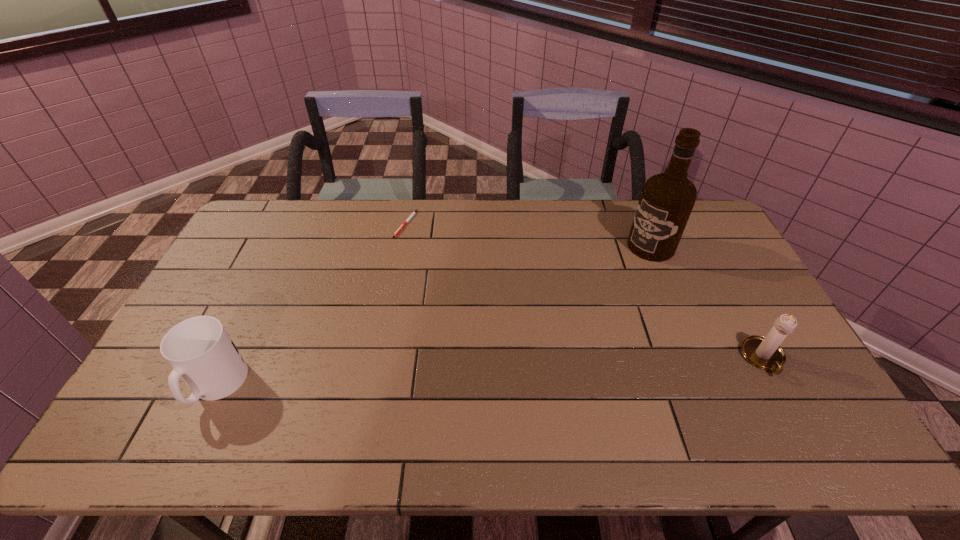
The image size is (960, 540). I want to click on vacant spot on the desktop that is between the leftmost object and the rightmost object and is positioned on the label of the third object from left to right, so click(472, 373).

You are a GUI agent. You are given a task and a screenshot of the screen. Output one action in this format:
    pyautogui.click(x=<x>, y=<y>)
    Task: Click on the vacant spot on the desktop that is between the mug and the candle holder and is positioned on the clicker of the second object from left to right
    
    Given the screenshot: What is the action you would take?
    pyautogui.click(x=415, y=375)